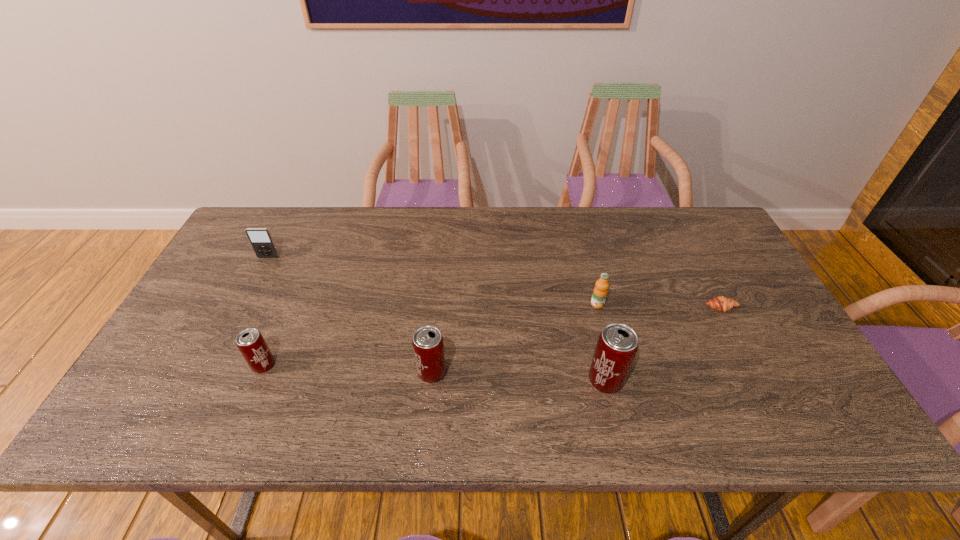
Where is `free space at the near edge of the desktop`? This screenshot has height=540, width=960. free space at the near edge of the desktop is located at coordinates (510, 369).

The image size is (960, 540). Find the location of `free space at the left edge of the desktop`. free space at the left edge of the desktop is located at coordinates (228, 292).

Identify the location of vacant space at the right edge. (756, 325).

At what (x,y) coordinates should I click in order to perform the action: click on vacant space at the far left corner. Please return your answer as a coordinate pair (x, y). This screenshot has width=960, height=540. Looking at the image, I should click on (273, 221).

In the image, there is a desktop. What are the coordinates of `vacant space at the far right corner` in the screenshot? It's located at (673, 208).

I want to click on empty space between the pastry and the shortest beer can, so click(x=492, y=336).

Where is `vacant point located between the fifth object from right to left and the second tallest beer can`? The width and height of the screenshot is (960, 540). vacant point located between the fifth object from right to left and the second tallest beer can is located at coordinates (348, 369).

Locate an element on the screen. This screenshot has width=960, height=540. free space between the orange juice and the leftmost object is located at coordinates (433, 281).

Where is `free space between the iPod and the shortest object`? The image size is (960, 540). free space between the iPod and the shortest object is located at coordinates (494, 282).

You are a GUI agent. You are given a task and a screenshot of the screen. Output one action in this format:
    pyautogui.click(x=<x>, y=<y>)
    Task: Click on the empty location between the fourth object from right to left and the orange juice
    
    Given the screenshot: What is the action you would take?
    click(515, 339)